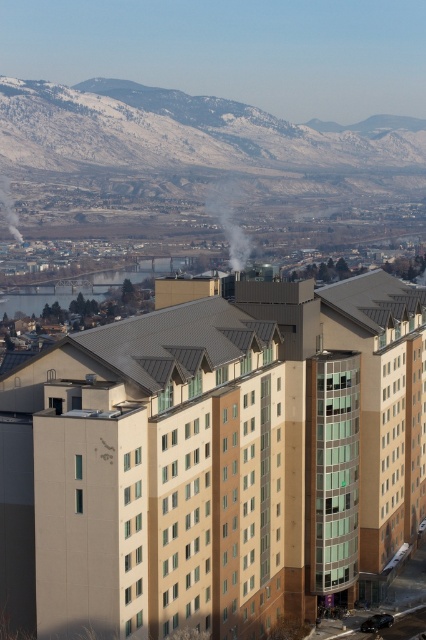
Does white smoke at center have a larger size compared to smokesmoky at left?

Indeed, white smoke at center has a larger size compared to smokesmoky at left.

Does white smoke at center appear on the right side of smokesmoky at left?

Correct, you'll find white smoke at center to the right of smokesmoky at left.

Is point (232, 246) less distant than point (13, 224)?

Yes, point (232, 246) is in front of point (13, 224).

Identify the location of white smoke at center. The image size is (426, 640). (230, 218).